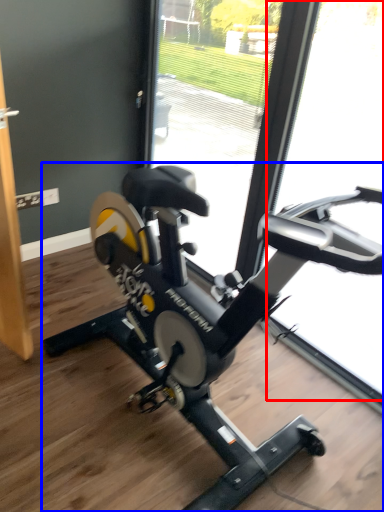
Question: Which point is closer to the camera, glass door (highlighted by a red box) or stationary bicycle (highlighted by a blue box)?

Choices:
 (A) glass door
 (B) stationary bicycle

Answer: (B)